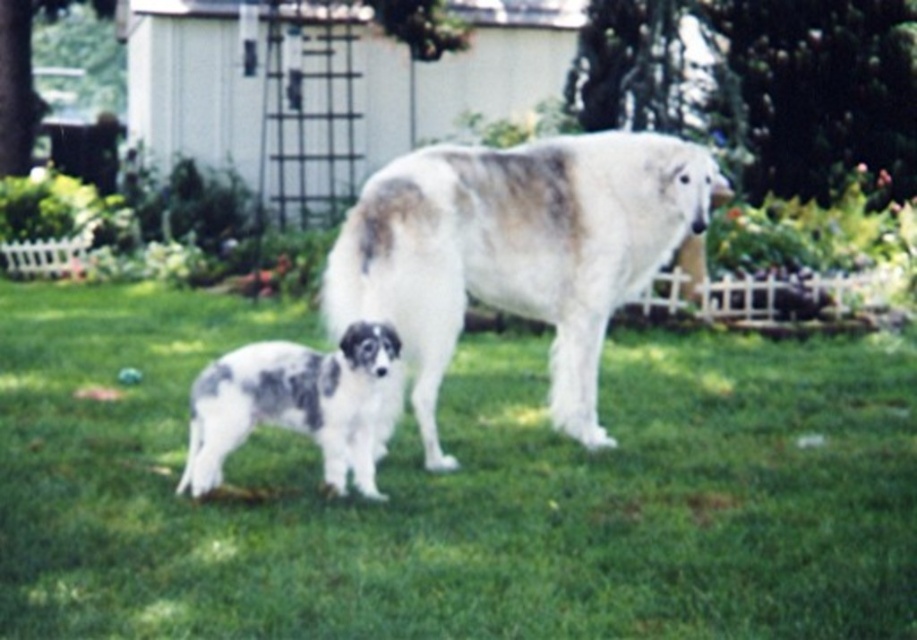
Consider the image. You are a photographer setting up a shot of the green grass at center and the spotted fur puppy at lower left. Which object is positioned closer to the camera?

The green grass at center is closer to the viewer than the spotted fur puppy at lower left, so the green grass at center would appear closer in the photograph.

You are trying to throw a ball for the dogs to chase. If you stand at the edge of the lawn where the green grass at center is visible, can you see the white fur dog at center through the grass?

The green grass at center is in front of the white fur dog at center, so the grass would block your view of the dog.